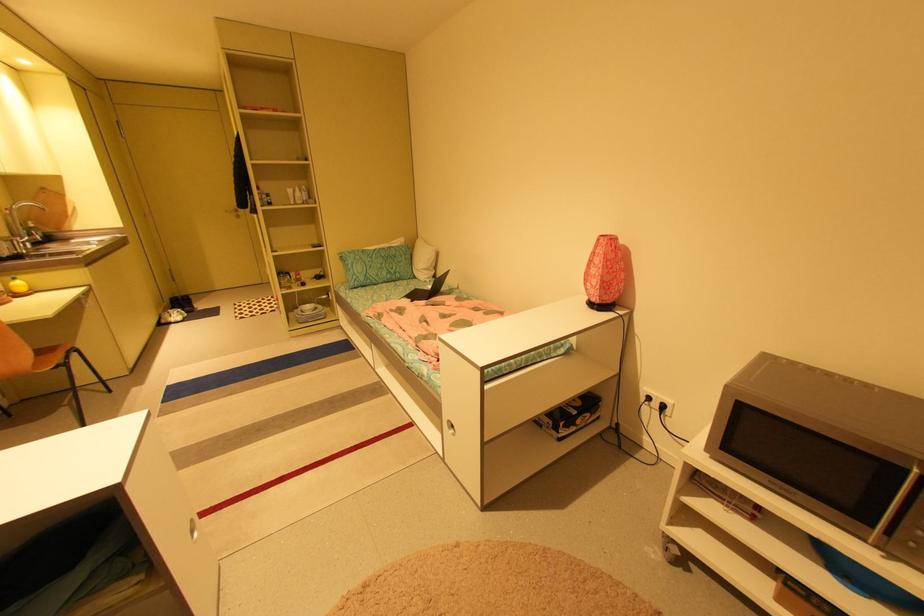
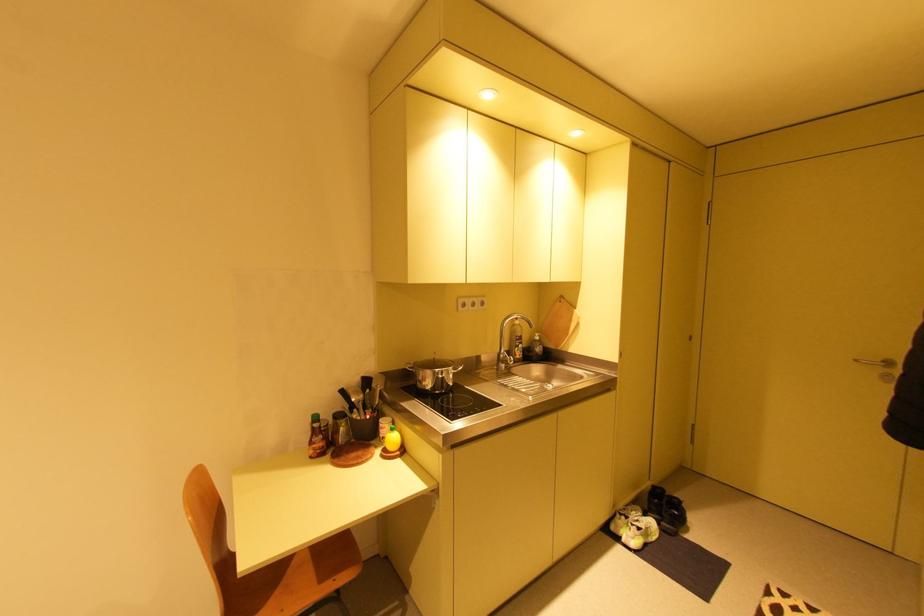
Where in the second image is the point corresponding to (x=191, y=310) from the first image?

(670, 524)